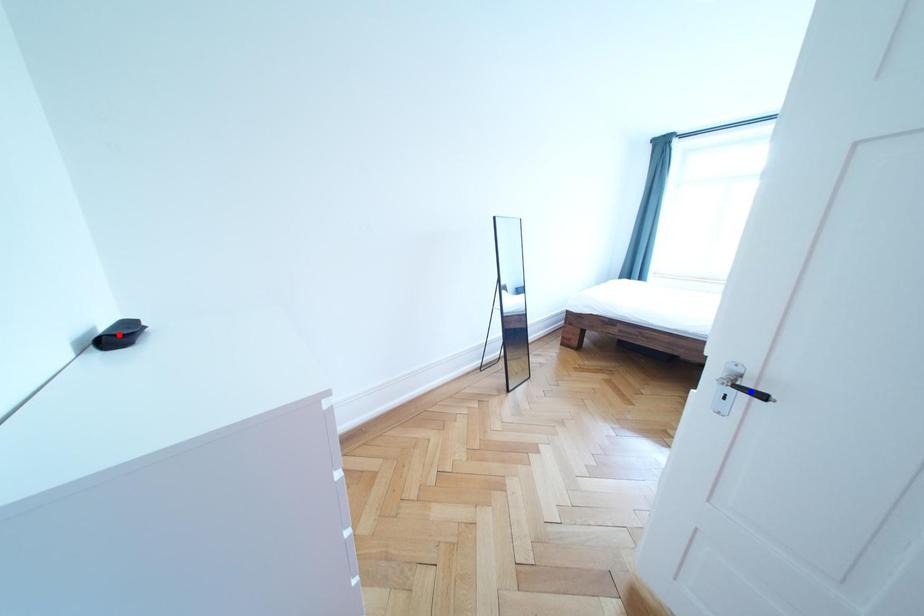
Question: Two points are marked on the image. Which point is closer to the camera?

Choices:
 (A) Blue point is closer.
 (B) Red point is closer.

Answer: (A)